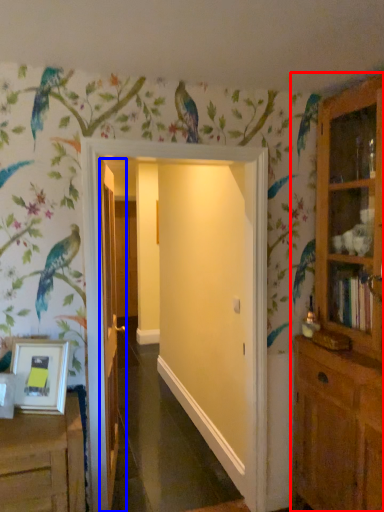
Question: Which object is further to the camera taking this photo, cupboard (highlighted by a red box) or door (highlighted by a blue box)?

Choices:
 (A) cupboard
 (B) door

Answer: (B)